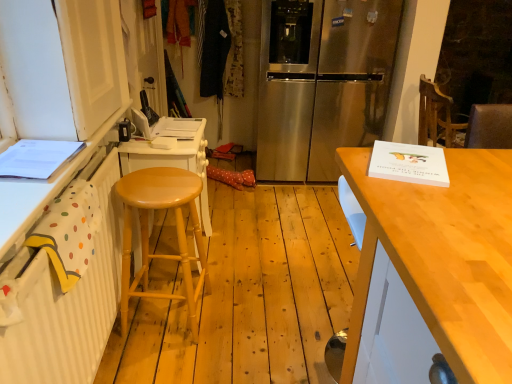
At what (x,y) coordinates should I click in order to perform the action: click on free point below light wood stool at left (from a real-world perspective). Please return your answer as a coordinate pair (x, y). This screenshot has width=512, height=384. Looking at the image, I should click on (164, 319).